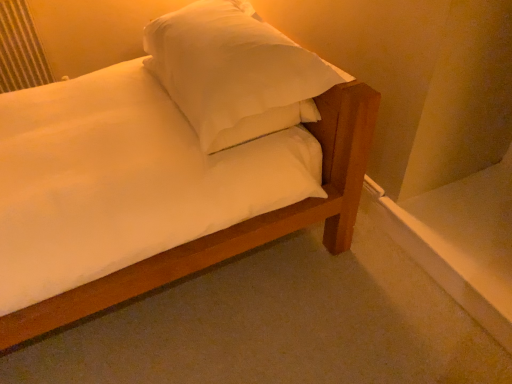
What do you see at coordinates (20, 49) in the screenshot? I see `metallic silver radiator at upper left` at bounding box center [20, 49].

What do you see at coordinates (234, 72) in the screenshot?
I see `white soft pillow at upper center` at bounding box center [234, 72].

Measure the distance between point [245,113] and camera.

They are 1.29 meters apart.

Measure the distance between point (168, 260) and camera.

Point (168, 260) is 4.18 feet from camera.

In order to click on metallic silver radiator at upper left in this screenshot , I will do `click(20, 49)`.

Where is `radiator behind the white soft pillow at upper center`? This screenshot has width=512, height=384. radiator behind the white soft pillow at upper center is located at coordinates (20, 49).

How much distance is there between white soft pillow at upper center and metallic silver radiator at upper left?

They are 1.19 meters apart.

Considering the sizes of white soft pillow at upper center and metallic silver radiator at upper left in the image, is white soft pillow at upper center wider or thinner than metallic silver radiator at upper left?

white soft pillow at upper center is wider than metallic silver radiator at upper left.

From the image's perspective, is white soft pillow at upper center located above or below metallic silver radiator at upper left?

→ white soft pillow at upper center is situated lower than metallic silver radiator at upper left in the image.

Does metallic silver radiator at upper left turn towards white matte bed at center?

No, metallic silver radiator at upper left is not turned towards white matte bed at center.

Can you confirm if metallic silver radiator at upper left is taller than white matte bed at center?

Yes, metallic silver radiator at upper left is taller than white matte bed at center.

From a real-world perspective, does metallic silver radiator at upper left stand above white matte bed at center?

No, from a real-world perspective, metallic silver radiator at upper left is not above white matte bed at center.

Can you confirm if metallic silver radiator at upper left is bigger than white matte bed at center?

Incorrect, metallic silver radiator at upper left is not larger than white matte bed at center.

Considering the relative sizes of metallic silver radiator at upper left and white soft pillow at upper center in the image provided, is metallic silver radiator at upper left thinner than white soft pillow at upper center?

Yes.

Is metallic silver radiator at upper left taller than white soft pillow at upper center?

Yes, metallic silver radiator at upper left is taller than white soft pillow at upper center.

Does point (27, 83) come behind point (276, 39)?

Yes, point (27, 83) is farther from viewer.

Is metallic silver radiator at upper left placed right next to white soft pillow at upper center?

No, metallic silver radiator at upper left is not next to white soft pillow at upper center.

Considering the positions of points (218, 65) and (341, 120), is point (218, 65) farther from camera compared to point (341, 120)?

No.

How different are the orientations of white soft pillow at upper center and white matte bed at center in degrees?

The angle between the facing direction of white soft pillow at upper center and the facing direction of white matte bed at center is 38.3 degrees.

Considering the positions of objects white soft pillow at upper center and white matte bed at center in the image provided, who is in front, white soft pillow at upper center or white matte bed at center?

white soft pillow at upper center is closer to the camera.

From the image's perspective, which object appears higher, white matte bed at center or metallic silver radiator at upper left?

metallic silver radiator at upper left.

The image size is (512, 384). Find the location of `radiator located on the left of white matte bed at center`. radiator located on the left of white matte bed at center is located at coordinates (20, 49).

From the picture: Can you tell me how much white matte bed at center and metallic silver radiator at upper left differ in facing direction?

There is a 105-degree angle between the facing directions of white matte bed at center and metallic silver radiator at upper left.

Who is taller, white matte bed at center or metallic silver radiator at upper left?

Standing taller between the two is metallic silver radiator at upper left.

Is point (359, 111) closer to viewer compared to point (240, 22)?

Yes, it is.

Which is more to the right, white matte bed at center or white soft pillow at upper center?

From the viewer's perspective, white soft pillow at upper center appears more on the right side.

Considering the sizes of objects white matte bed at center and white soft pillow at upper center in the image provided, who is bigger, white matte bed at center or white soft pillow at upper center?

white soft pillow at upper center.

Identify the location of pillow lying below the metallic silver radiator at upper left (from the image's perspective). (234, 72).

Identify the location of radiator that appears below the white matte bed at center (from a real-world perspective). (20, 49).

Looking at the image, which one is located closer to white soft pillow at upper center, metallic silver radiator at upper left or white matte bed at center?

white matte bed at center is closer to white soft pillow at upper center.

Looking at the image, which one is located closer to white soft pillow at upper center, white matte bed at center or metallic silver radiator at upper left?

white matte bed at center lies closer to white soft pillow at upper center than the other object.

Looking at the image, which one is located further to metallic silver radiator at upper left, white matte bed at center or white soft pillow at upper center?

Based on the image, white matte bed at center appears to be further to metallic silver radiator at upper left.

Based on the photo, looking at the image, which one is located closer to metallic silver radiator at upper left, white soft pillow at upper center or white matte bed at center?

white soft pillow at upper center is closer to metallic silver radiator at upper left.

Based on the photo, estimate the real-world distances between objects in this image. Which object is further from white matte bed at center, white soft pillow at upper center or metallic silver radiator at upper left?

metallic silver radiator at upper left lies further to white matte bed at center than the other object.

Estimate the real-world distances between objects in this image. Which object is closer to white matte bed at center, metallic silver radiator at upper left or white soft pillow at upper center?

white soft pillow at upper center.

The width and height of the screenshot is (512, 384). What are the coordinates of `bed situated between metallic silver radiator at upper left and white soft pillow at upper center from left to right` in the screenshot? It's located at (234, 225).